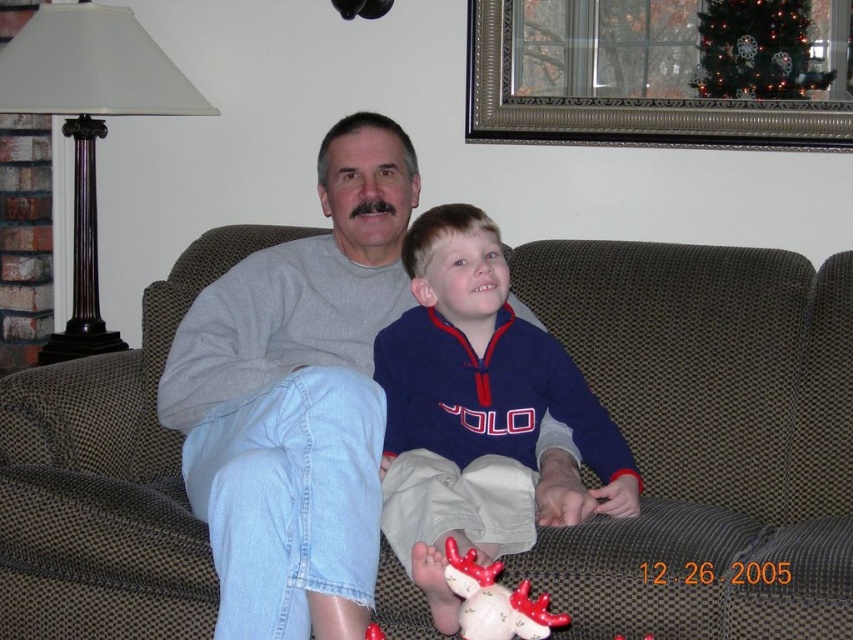
Question: Estimate the real-world distances between objects in this image. Which object is closer to the gray cotton sweatshirt at center?

Choices:
 (A) brown fabric couch at center
 (B) matte red plush reindeer at lower center

Answer: (A)

Question: Does brown fabric couch at center appear over matte red plush reindeer at lower center?

Choices:
 (A) no
 (B) yes

Answer: (B)

Question: Which object appears farthest from the camera in this image?

Choices:
 (A) gray cotton sweatshirt at center
 (B) blue fleece jacket at center
 (C) matte red plush reindeer at lower center
 (D) brown fabric couch at center

Answer: (D)

Question: Is gray cotton sweatshirt at center positioned behind blue fleece jacket at center?

Choices:
 (A) yes
 (B) no

Answer: (A)

Question: Can you confirm if gray cotton sweatshirt at center is positioned above blue fleece jacket at center?

Choices:
 (A) no
 (B) yes

Answer: (B)

Question: Which is nearer to the gray cotton sweatshirt at center?

Choices:
 (A) brown fabric couch at center
 (B) matte red plush reindeer at lower center

Answer: (A)